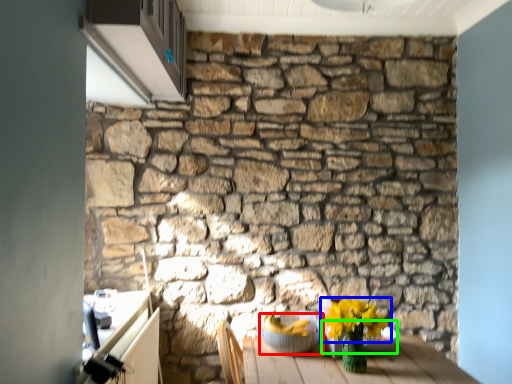
Question: Which object is positioned farthest from glass bowl (highlighted by a red box)? Select from flower (highlighted by a blue box) and glass bowl (highlighted by a green box).

Choices:
 (A) flower
 (B) glass bowl

Answer: (A)